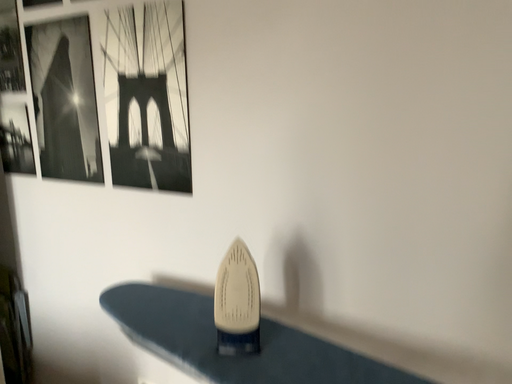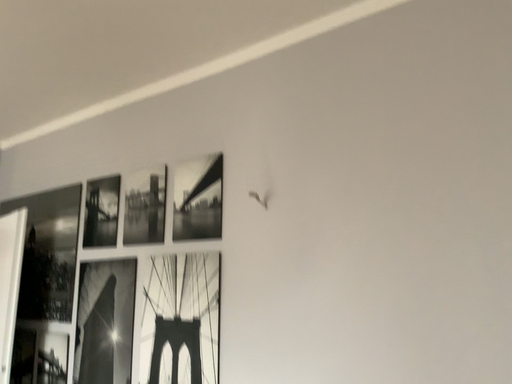
Question: Which way did the camera rotate in the video?

Choices:
 (A) rotated upward
 (B) rotated downward

Answer: (A)